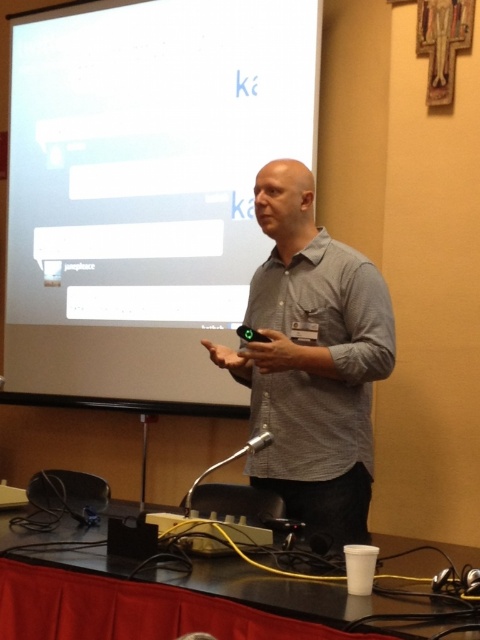
Does yellow cable at lower center have a lesser height compared to metallic silver microphone at lower center?

Indeed, yellow cable at lower center has a lesser height compared to metallic silver microphone at lower center.

Is yellow cable at lower center to the left of metallic silver microphone at lower center from the viewer's perspective?

In fact, yellow cable at lower center is to the right of metallic silver microphone at lower center.

The width and height of the screenshot is (480, 640). What do you see at coordinates (208, 532) in the screenshot?
I see `yellow cable at lower center` at bounding box center [208, 532].

Locate an element on the screen. yellow cable at lower center is located at coordinates (208, 532).

Find the location of a particular element. This screenshot has height=640, width=480. gray checkered shirt at center is located at coordinates (312, 358).

Between gray checkered shirt at center and metallic silver microphone at lower center, which one is positioned lower?

metallic silver microphone at lower center

Is point (267, 284) positioned after point (189, 502)?

Yes.

The height and width of the screenshot is (640, 480). In order to click on gray checkered shirt at center in this screenshot , I will do `click(312, 358)`.

Does white matte projection screen at upper center have a larger size compared to metallic silver microphone at lower center?

Correct, white matte projection screen at upper center is larger in size than metallic silver microphone at lower center.

Who is positioned more to the left, white matte projection screen at upper center or metallic silver microphone at lower center?

From the viewer's perspective, white matte projection screen at upper center appears more on the left side.

I want to click on white matte projection screen at upper center, so click(x=144, y=189).

What are the coordinates of `white matte projection screen at upper center` in the screenshot? It's located at (144, 189).